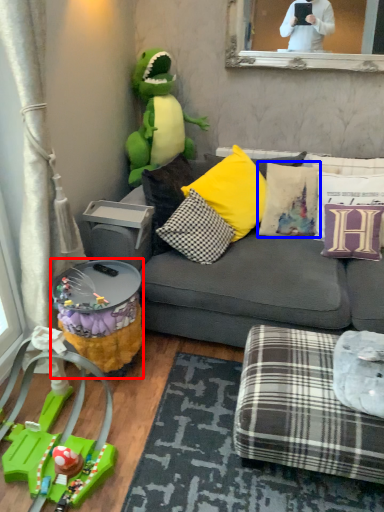
Question: Among these objects, which one is farthest to the camera, side table (highlighted by a red box) or pillow (highlighted by a blue box)?

Choices:
 (A) side table
 (B) pillow

Answer: (B)